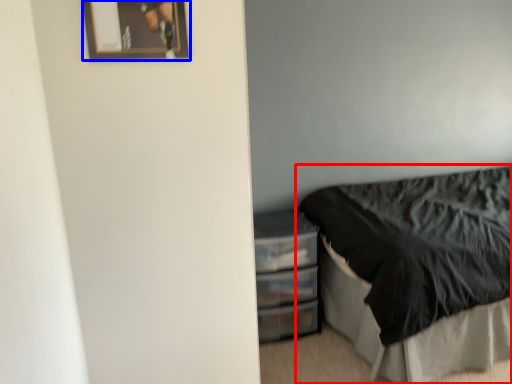
Question: Which object appears closest to the camera in this image, bed (highlighted by a red box) or picture frame (highlighted by a blue box)?

Choices:
 (A) bed
 (B) picture frame

Answer: (B)